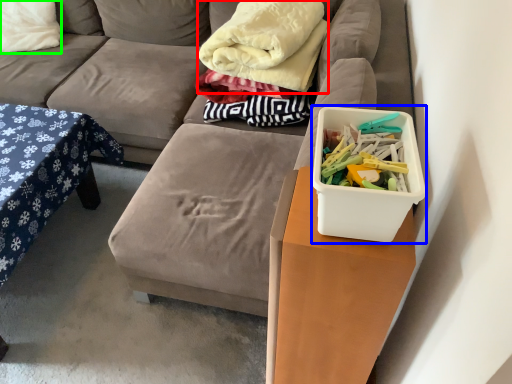
Question: Considering the real-world distances, which object is farthest from blanket (highlighted by a red box)? storage box (highlighted by a blue box) or pillow (highlighted by a green box)?

Choices:
 (A) storage box
 (B) pillow

Answer: (B)